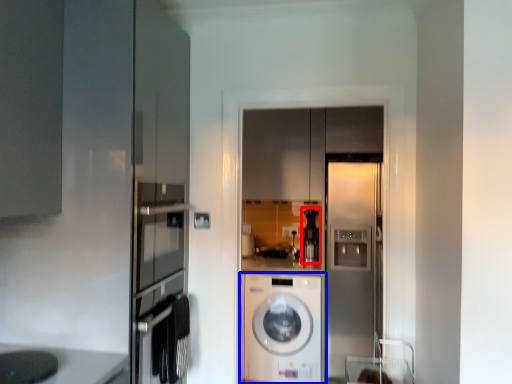
Question: Which of the following is the closest to the observer, coffee machine (highlighted by a red box) or washing machine (highlighted by a blue box)?

Choices:
 (A) coffee machine
 (B) washing machine

Answer: (B)